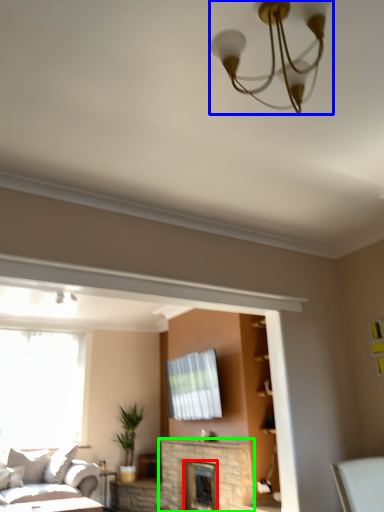
Question: Which is farther away from fireplace (highlighted by a red box)? lamp (highlighted by a blue box) or fireplace (highlighted by a green box)?

Choices:
 (A) lamp
 (B) fireplace

Answer: (A)